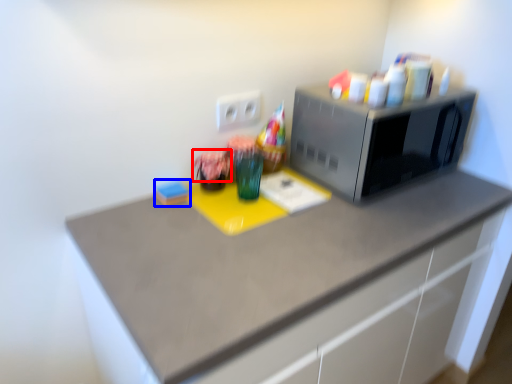
Question: Which point is further to the camera, flower (highlighted by a red box) or stationery (highlighted by a blue box)?

Choices:
 (A) flower
 (B) stationery

Answer: (B)